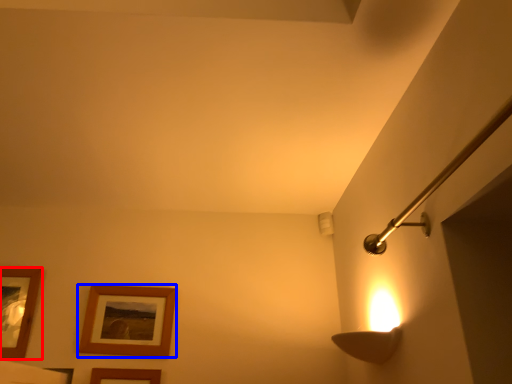
Question: Which of the following is the closest to the observer, picture frame (highlighted by a red box) or picture frame (highlighted by a blue box)?

Choices:
 (A) picture frame
 (B) picture frame

Answer: (A)